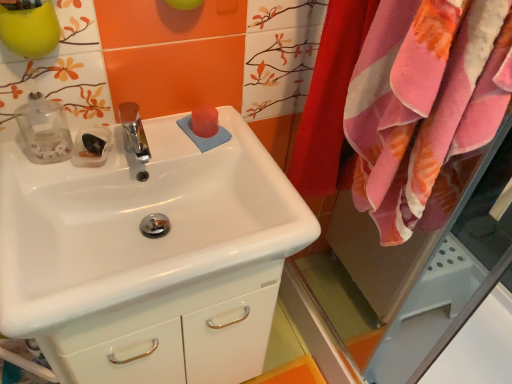
Question: Considering the relative sizes of pink plush towel at right and pink soft towel at right in the image provided, is pink plush towel at right smaller than pink soft towel at right?

Choices:
 (A) no
 (B) yes

Answer: (B)

Question: Does pink plush towel at right have a greater height compared to pink soft towel at right?

Choices:
 (A) no
 (B) yes

Answer: (A)

Question: Is pink plush towel at right positioned far away from pink soft towel at right?

Choices:
 (A) no
 (B) yes

Answer: (A)

Question: Is pink plush towel at right turned away from pink soft towel at right?

Choices:
 (A) yes
 (B) no

Answer: (B)

Question: From a real-world perspective, is pink plush towel at right physically above pink soft towel at right?

Choices:
 (A) yes
 (B) no

Answer: (B)

Question: Does point (421, 198) appear closer or farther from the camera than point (345, 91)?

Choices:
 (A) farther
 (B) closer

Answer: (B)

Question: Is pink soft towel at right spatially inside pink plush towel at right, or outside of it?

Choices:
 (A) outside
 (B) inside

Answer: (A)

Question: Is pink soft towel at right bigger or smaller than pink plush towel at right?

Choices:
 (A) small
 (B) big

Answer: (B)

Question: In terms of width, does pink soft towel at right look wider or thinner when compared to pink plush towel at right?

Choices:
 (A) thin
 (B) wide

Answer: (B)

Question: From a real-world perspective, relative to pink soft towel at right, is pink plush towel at right vertically above or below?

Choices:
 (A) below
 (B) above

Answer: (A)

Question: From their relative heights in the image, would you say pink plush towel at right is taller or shorter than pink soft towel at right?

Choices:
 (A) short
 (B) tall

Answer: (A)

Question: Considering the relative positions of pink plush towel at right and pink soft towel at right in the image provided, is pink plush towel at right to the left or to the right of pink soft towel at right?

Choices:
 (A) left
 (B) right

Answer: (A)

Question: Is pink plush towel at right in front of or behind pink soft towel at right in the image?

Choices:
 (A) front
 (B) behind

Answer: (B)

Question: From the image's perspective, is white glossy sink at center positioned above or below pink soft towel at right?

Choices:
 (A) below
 (B) above

Answer: (A)

Question: Considering the positions of white glossy sink at center and pink soft towel at right in the image, is white glossy sink at center wider or thinner than pink soft towel at right?

Choices:
 (A) thin
 (B) wide

Answer: (B)